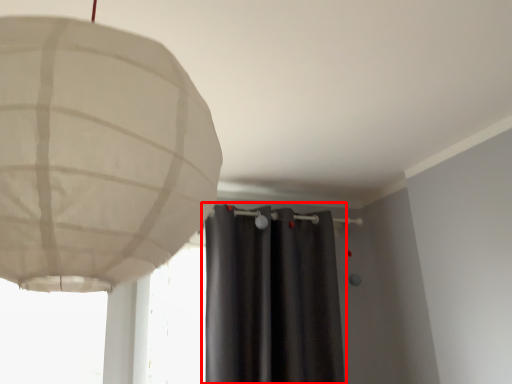
Question: From the image's perspective, where is curtain (annotated by the red box) located in relation to lamp in the image?

Choices:
 (A) above
 (B) below

Answer: (B)